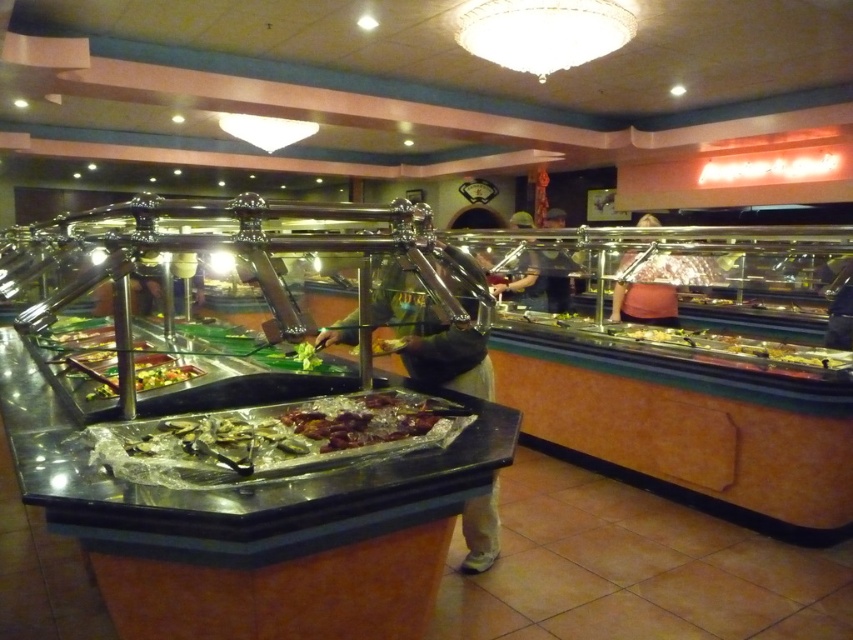
Question: Does shiny metallic meat at center appear on the left side of green leafy vegetables at center?

Choices:
 (A) yes
 (B) no

Answer: (B)

Question: Does shiny metallic meat at center appear under green leafy vegetables at center?

Choices:
 (A) yes
 (B) no

Answer: (A)

Question: Which of the following is the closest to the observer?

Choices:
 (A) (180, 374)
 (B) (310, 432)

Answer: (B)

Question: Is shiny metallic meat at center closer to the viewer compared to green leafy vegetables at center?

Choices:
 (A) no
 (B) yes

Answer: (B)

Question: Among these points, which one is farthest from the camera?

Choices:
 (A) [x=115, y=378]
 (B) [x=352, y=440]

Answer: (A)